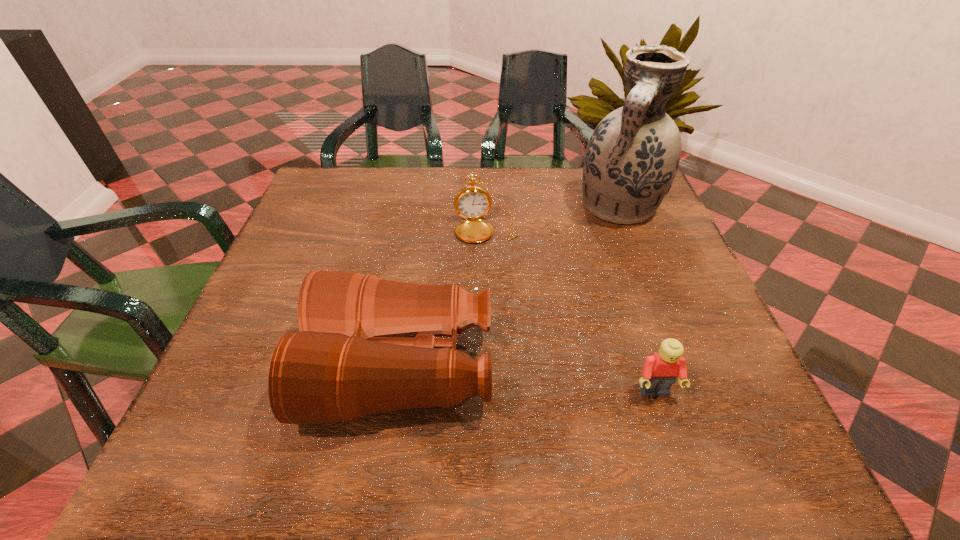
You are a GUI agent. You are given a task and a screenshot of the screen. Output one action in this format:
    pyautogui.click(x=<x>, y=<y>)
    Task: Click on the vacant spot on the desktop that is between the binoculars and the Lego and is positioned on the face of the pocket watch
    Image resolution: width=960 pixels, height=540 pixels.
    Given the screenshot: What is the action you would take?
    506,377

The image size is (960, 540). I want to click on free spot on the desktop that is between the binoculars and the Lego and is positioned with the handle on the side of the vase, so click(543, 381).